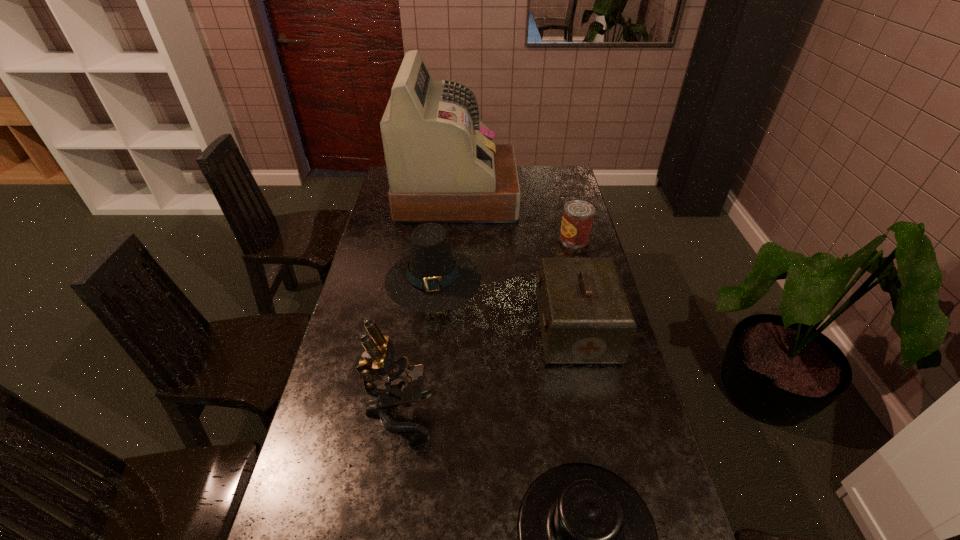
Identify the location of object at the far left corner. The width and height of the screenshot is (960, 540). (443, 167).

The image size is (960, 540). I want to click on vacant area at the left edge of the desktop, so click(386, 239).

You are a GUI agent. You are given a task and a screenshot of the screen. Output one action in this format:
    pyautogui.click(x=<x>, y=<y>)
    Task: Click on the free location at the right edge
    The width and height of the screenshot is (960, 540).
    Given the screenshot: What is the action you would take?
    pyautogui.click(x=552, y=216)

The width and height of the screenshot is (960, 540). I want to click on vacant space at the far right corner of the desktop, so click(573, 181).

At what (x,y) coordinates should I click in order to perform the action: click on empty space that is in between the first-aid kit and the farthest object. Please return your answer as a coordinate pair (x, y). This screenshot has width=960, height=540. Looking at the image, I should click on pyautogui.click(x=516, y=262).

This screenshot has width=960, height=540. I want to click on free point between the farthest object and the first-aid kit, so click(516, 262).

This screenshot has width=960, height=540. I want to click on free spot between the fifth shortest object and the taller dress hat, so click(416, 345).

Where is `free area in between the fifth shortest object and the fifth tallest object`? The height and width of the screenshot is (540, 960). free area in between the fifth shortest object and the fifth tallest object is located at coordinates (487, 325).

Select which object appears as the third closest to the left dress hat. Please provide its 2D coordinates. Your answer should be formatted as a tuple, i.e. [(x, y)], where the tuple contains the x and y coordinates of a point satisfying the conditions above.

[(403, 381)]

I want to click on the closest object to the shortest object, so click(x=403, y=381).